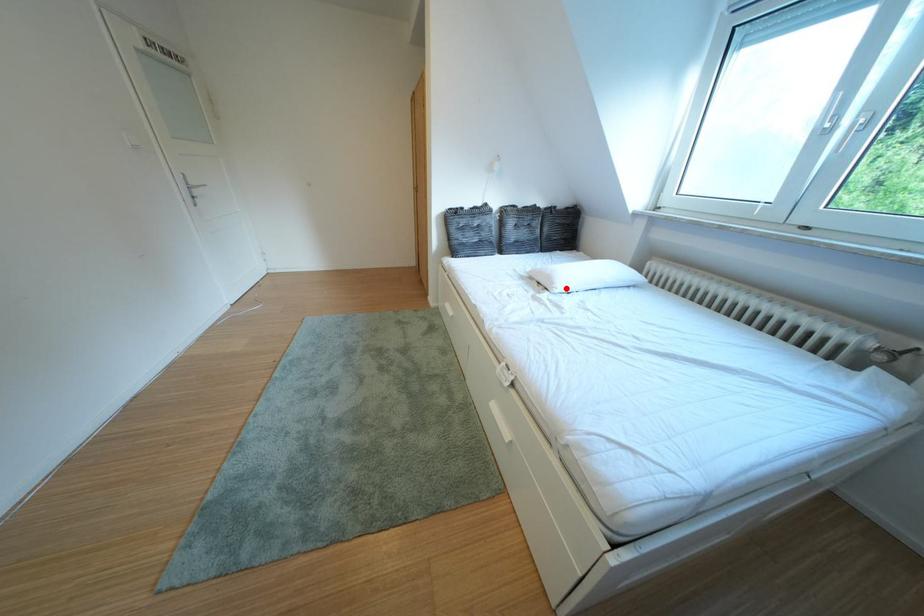
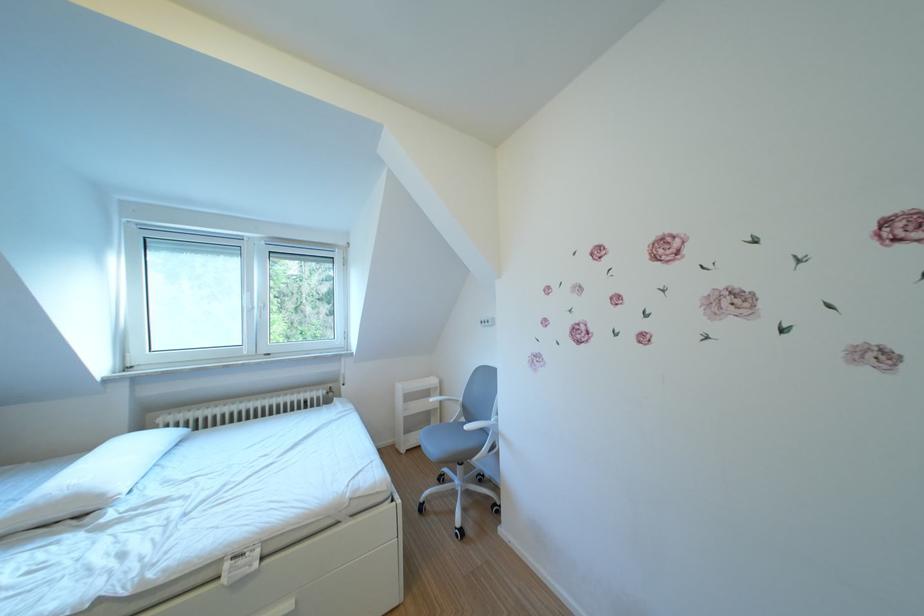
Question: I am providing you with two images of the same scene from different viewpoints. A red point is marked on the first image. At the location where the point appears in image 1, is it still visible in image 2?

Choices:
 (A) Yes
 (B) No

Answer: (A)